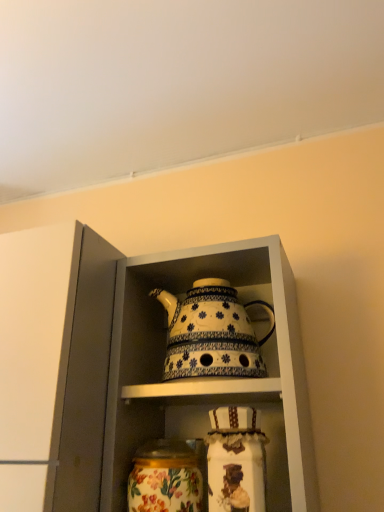
What is the approximate height of floral painted glass jar at lower center?

It is 6.28 inches.

What do you see at coordinates (165, 478) in the screenshot?
I see `floral painted glass jar at lower center` at bounding box center [165, 478].

Identify the location of white glossy teapot at center. (x=130, y=367).

The image size is (384, 512). What do you see at coordinates (212, 333) in the screenshot? I see `white ceramic teapot at center` at bounding box center [212, 333].

Locate an element on the screen. floral painted glass jar at lower center is located at coordinates (165, 478).

Is point (168, 379) closer or farther from the camera than point (130, 490)?

Clearly, point (168, 379) is more distant from the camera than point (130, 490).

Is white ceramic teapot at center not near floral painted glass jar at lower center?

They are positioned close to each other.

Is white ceramic teapot at center looking in the opposite direction of floral painted glass jar at lower center?

white ceramic teapot at center is not turned away from floral painted glass jar at lower center.

Identify the location of glass vase in front of the white ceramic teapot at center. (165, 478).

From the picture: Between white glossy teapot at center and floral painted glass jar at lower center, which one has larger width?

Wider between the two is white glossy teapot at center.

Considering the relative positions of white glossy teapot at center and floral painted glass jar at lower center in the image provided, is white glossy teapot at center to the left of floral painted glass jar at lower center from the viewer's perspective?

Incorrect, white glossy teapot at center is not on the left side of floral painted glass jar at lower center.

From the image's perspective, between white glossy teapot at center and floral painted glass jar at lower center, which one is located above?

white glossy teapot at center.

How different are the orientations of white ceramic teapot at center and white glossy teapot at center in degrees?

white ceramic teapot at center and white glossy teapot at center are facing 1.49 degrees away from each other.

From the image's perspective, between white ceramic teapot at center and white glossy teapot at center, which one is located above?

white ceramic teapot at center is shown above in the image.

Identify the location of cabinetry that is below the white ceramic teapot at center (from the image's perspective). Image resolution: width=384 pixels, height=512 pixels. (130, 367).

In terms of width, does floral painted glass jar at lower center look wider or thinner when compared to white glossy teapot at center?

In the image, floral painted glass jar at lower center appears to be more narrow than white glossy teapot at center.

Can you confirm if floral painted glass jar at lower center is taller than white glossy teapot at center?

In fact, floral painted glass jar at lower center may be shorter than white glossy teapot at center.

From a real-world perspective, which is physically below, floral painted glass jar at lower center or white glossy teapot at center?

floral painted glass jar at lower center, from a real-world perspective.

From the image's perspective, which is above, floral painted glass jar at lower center or white glossy teapot at center?

From the image's view, white glossy teapot at center is above.

Is floral painted glass jar at lower center aimed at white ceramic teapot at center?

No, floral painted glass jar at lower center is not oriented towards white ceramic teapot at center.

From their relative heights in the image, would you say floral painted glass jar at lower center is taller or shorter than white ceramic teapot at center?

floral painted glass jar at lower center is shorter than white ceramic teapot at center.

Is floral painted glass jar at lower center bigger than white ceramic teapot at center?

Incorrect, floral painted glass jar at lower center is not larger than white ceramic teapot at center.

Is floral painted glass jar at lower center touching white ceramic teapot at center?

No, floral painted glass jar at lower center is not with white ceramic teapot at center.

Is white glossy teapot at center oriented towards white ceramic teapot at center?

Yes, white glossy teapot at center is aimed at white ceramic teapot at center.

Do you think white glossy teapot at center is within white ceramic teapot at center, or outside of it?

white glossy teapot at center is not enclosed by white ceramic teapot at center.

Where is `cabinetry below the white ceramic teapot at center (from a real-world perspective)`? This screenshot has height=512, width=384. cabinetry below the white ceramic teapot at center (from a real-world perspective) is located at coordinates (130, 367).

From the image's perspective, is white glossy teapot at center located above white ceramic teapot at center?

No.

Identify the location of kettle behind the floral painted glass jar at lower center. (212, 333).

Image resolution: width=384 pixels, height=512 pixels. I want to click on cabinetry above the floral painted glass jar at lower center (from a real-world perspective), so click(130, 367).

Estimate the real-world distances between objects in this image. Which object is further from white ceramic teapot at center, white glossy teapot at center or floral painted glass jar at lower center?

Among the two, floral painted glass jar at lower center is located further to white ceramic teapot at center.

Estimate the real-world distances between objects in this image. Which object is further from white glossy teapot at center, floral painted glass jar at lower center or white ceramic teapot at center?

floral painted glass jar at lower center lies further to white glossy teapot at center than the other object.

Which object lies nearer to the anchor point white ceramic teapot at center, floral painted glass jar at lower center or white glossy teapot at center?

white glossy teapot at center is positioned closer to the anchor white ceramic teapot at center.

Estimate the real-world distances between objects in this image. Which object is further from white glossy teapot at center, white ceramic teapot at center or floral painted glass jar at lower center?

The object further to white glossy teapot at center is floral painted glass jar at lower center.

Considering their positions, is white ceramic teapot at center positioned closer to floral painted glass jar at lower center than white glossy teapot at center?

Based on the image, white ceramic teapot at center appears to be nearer to floral painted glass jar at lower center.

Which object lies further to the anchor point floral painted glass jar at lower center, white glossy teapot at center or white ceramic teapot at center?

Among the two, white glossy teapot at center is located further to floral painted glass jar at lower center.

You are a GUI agent. You are given a task and a screenshot of the screen. Output one action in this format:
    pyautogui.click(x=<x>, y=<y>)
    Task: Click on the cabinetry between white ceramic teapot at center and floral painted glass jar at lower center from top to bottom
    The image size is (384, 512).
    Given the screenshot: What is the action you would take?
    (130, 367)